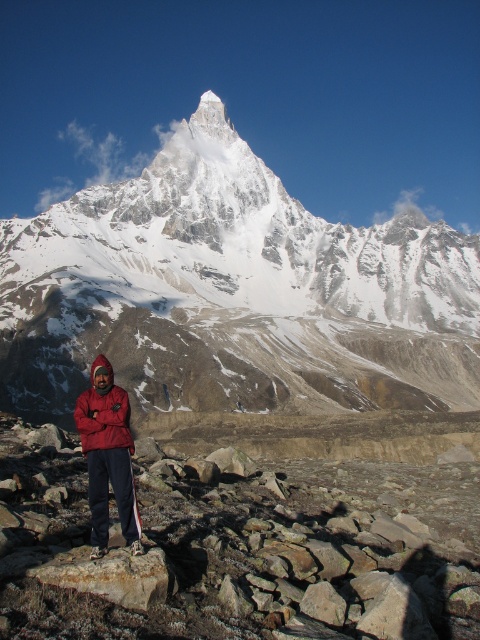
You are a hiker who wants to take a photo of the snowy granite peak at upper center while standing near the red fleece jacket at lower left. To get the best shot, should you move to your left or right?

Since the snowy granite peak at upper center is to the right of the red fleece jacket at lower left, you should move to your right to position yourself for the best shot.

You are planning to take a photo of the snow covered peak in the background. You have two jackets available, the matte red jacket at lower left and the red fleece jacket at lower left. Which jacket should you wear to ensure you are less visible against the rocky terrain?

The matte red jacket at lower left is thinner than the red fleece jacket at lower left, so wearing the thinner matte red jacket at lower left would make you less visible against the rocky terrain.

You are a photographer planning to capture the snowy granite peak at upper center and the red fleece jacket at lower left in a single frame. Considering their heights, which object will appear larger in the photo?

The snowy granite peak at upper center will appear larger in the photo because it has a greater height compared to the red fleece jacket at lower left.